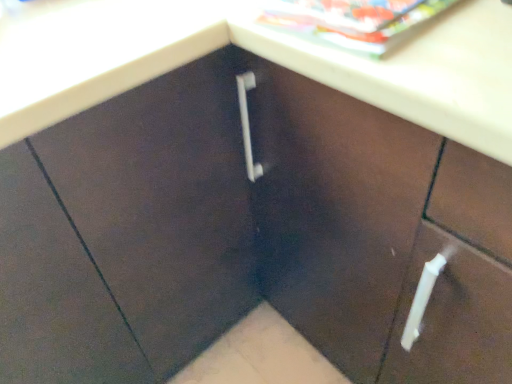
Measure the distance between point (279, 8) and camera.

Point (279, 8) and camera are 24.33 inches apart from each other.

Locate an element on the screen. The image size is (512, 384). matte paper comic book at upper right is located at coordinates (352, 21).

Image resolution: width=512 pixels, height=384 pixels. Describe the element at coordinates (352, 21) in the screenshot. I see `matte paper comic book at upper right` at that location.

The width and height of the screenshot is (512, 384). What are the coordinates of `matte paper comic book at upper right` in the screenshot? It's located at (352, 21).